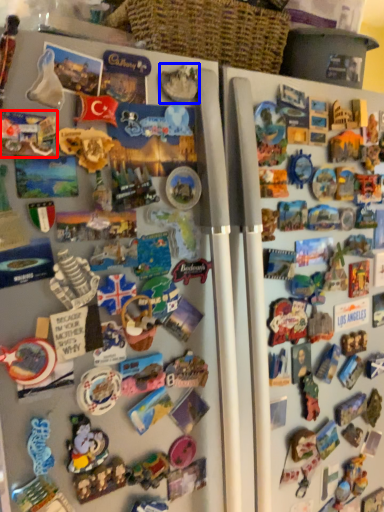
Question: Which object is further to the camera taking this photo, toy (highlighted by a red box) or toy (highlighted by a blue box)?

Choices:
 (A) toy
 (B) toy

Answer: (B)